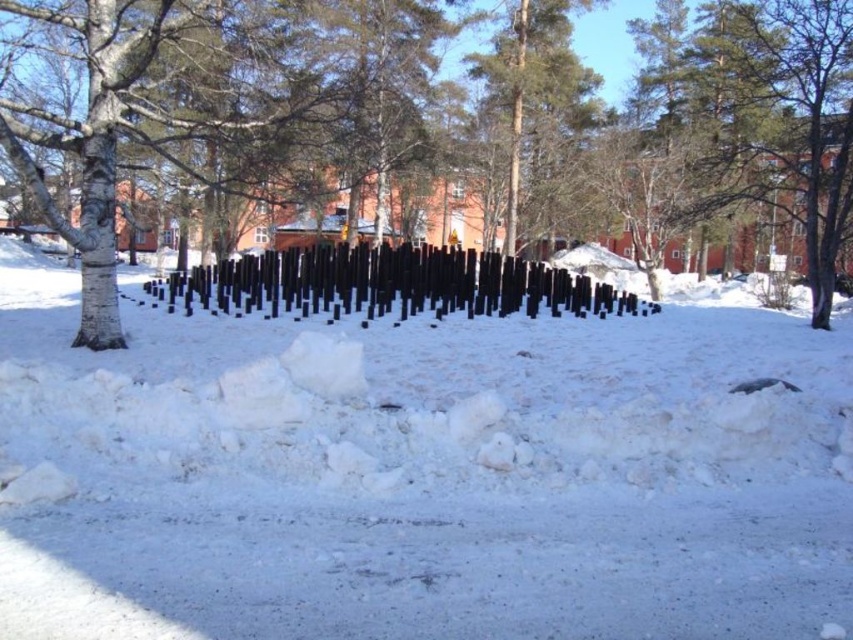
You are standing at the point labeled point (339, 560) and want to walk towards the point labeled point (540, 92). Which direction should you face to move closer to your destination?

Since point (339, 560) is closer to the viewer than point (540, 92), you should face towards the background direction to move closer to point (540, 92).

You are planning to build a snowman using the white fluffy snow at center and want to place it near the black polished wood posts at center. Considering the amount of snow available, will you have enough material to build a large snowman?

The white fluffy snow at center occupies less space than black polished wood posts at center, so there might not be enough material to build a large snowman.